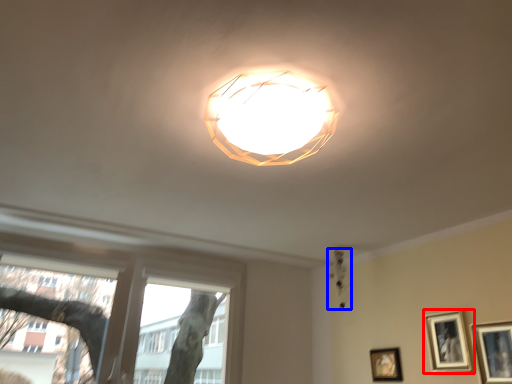
Question: Among these objects, which one is farthest to the camera, picture frame (highlighted by a red box) or lamp (highlighted by a blue box)?

Choices:
 (A) picture frame
 (B) lamp

Answer: (B)